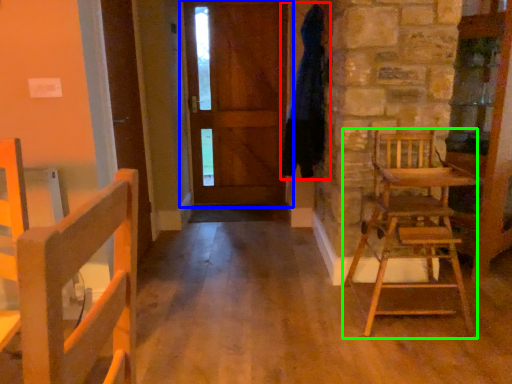
Question: Based on their relative distances, which object is farther from bathrobe (highlighted by a red box)? Choose from door (highlighted by a blue box) and chair (highlighted by a green box).

Choices:
 (A) door
 (B) chair

Answer: (A)